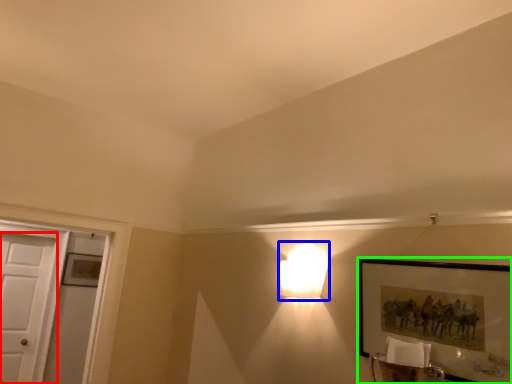
Question: Considering the real-world distances, which object is closest to door (highlighted by a red box)? lamp (highlighted by a blue box) or picture frame (highlighted by a green box).

Choices:
 (A) lamp
 (B) picture frame

Answer: (A)